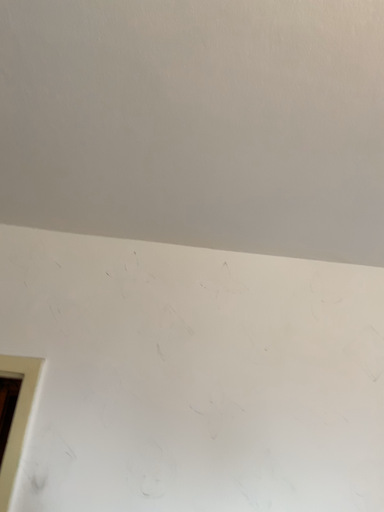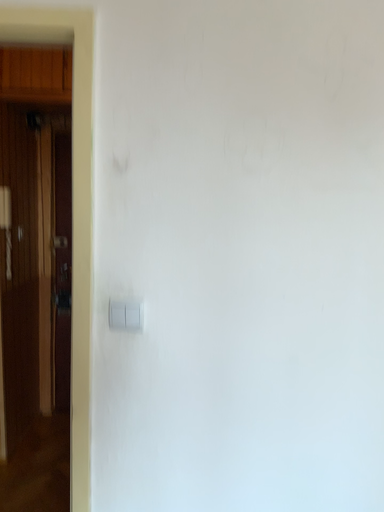
Question: How did the camera likely rotate when shooting the video?

Choices:
 (A) rotated downward
 (B) rotated upward

Answer: (A)